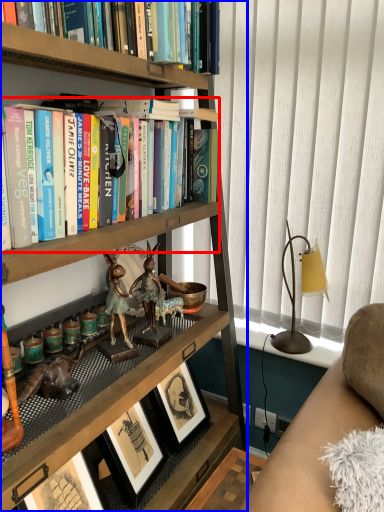
Question: Which object is closer to the camera taking this photo, book (highlighted by a red box) or bookcase (highlighted by a blue box)?

Choices:
 (A) book
 (B) bookcase

Answer: (B)